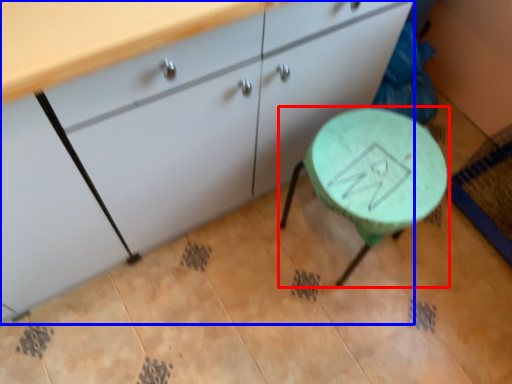
Question: Which object appears farthest to the camera in this image, table (highlighted by a red box) or cabinetry (highlighted by a blue box)?

Choices:
 (A) table
 (B) cabinetry

Answer: (A)